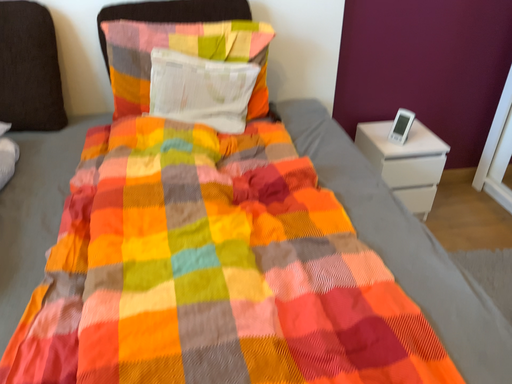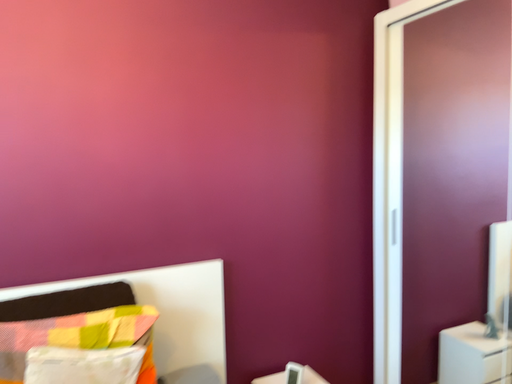
Question: How did the camera likely rotate when shooting the video?

Choices:
 (A) rotated downward
 (B) rotated upward

Answer: (B)